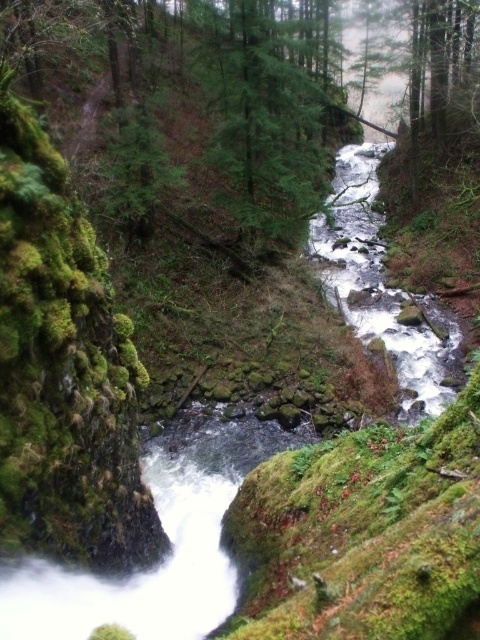
You are a hiker trying to cross the stream. You see the green mossy tree at center and the white frothy water at center. Which object is closer to you as you stand on the bank?

The green mossy tree at center is closer to you because it is in front of the white frothy water at center.

You are a hiker who wants to cross the stream. You see a green mossy tree at center and white frothy water at center. Which object should you avoid stepping on to cross safely?

You should avoid stepping on the white frothy water at center because it indicates moving water, which is unsafe for crossing. The green mossy tree at center is solid ground and can provide a stable path.

You are a hiker who wants to cross the stream at the center of the forest scene. The green mossy tree at center is on your left, and the white frothy water at center is flowing to your right. Can you safely cross the stream between them if your maximum safe crossing distance is 20 feet?

The distance between the green mossy tree at center and the white frothy water at center is 20.60 feet, which exceeds your maximum safe crossing distance of 20 feet. Therefore, it is not safe to cross the stream between them.